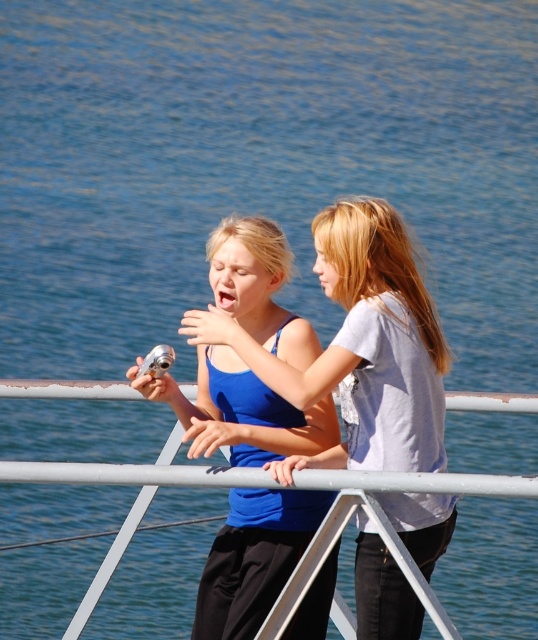
Question: Which of the following is the farthest from the observer?

Choices:
 (A) matte blue tank top at center
 (B) metallic gray rail at center

Answer: (A)

Question: Can you confirm if matte blue tank top at center is positioned to the right of metallic gray rail at center?

Choices:
 (A) yes
 (B) no

Answer: (A)

Question: Which of the following is the farthest from the observer?

Choices:
 (A) (369, 294)
 (B) (214, 481)
 (C) (222, 368)

Answer: (C)

Question: Where is matte blue tank top at center located in relation to metallic gray rail at center in the image?

Choices:
 (A) above
 (B) below

Answer: (A)

Question: Which object appears closest to the camera in this image?

Choices:
 (A) blue matte tank top at center
 (B) matte blue tank top at center
 (C) metallic gray rail at center

Answer: (C)

Question: Does blue matte tank top at center appear over metallic gray rail at center?

Choices:
 (A) no
 (B) yes

Answer: (B)